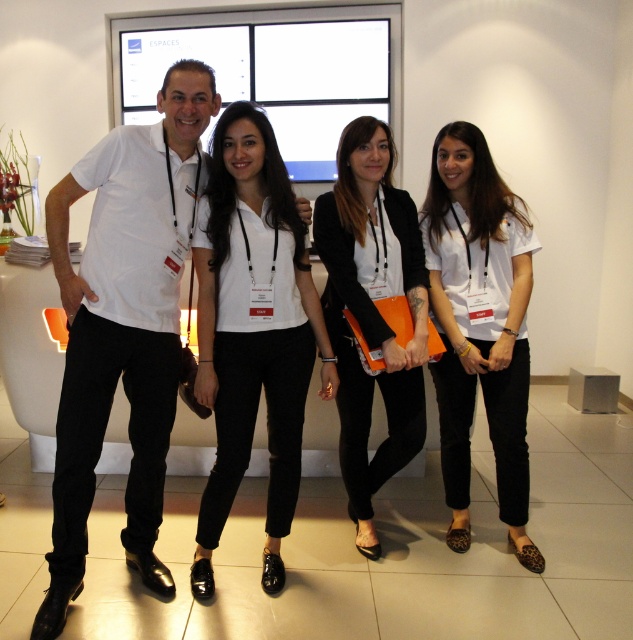
Question: Which object is closer to the camera taking this photo?

Choices:
 (A) black leather jacket at center
 (B) white matte shirt at center

Answer: (A)

Question: Can you confirm if white smooth shirt at left is positioned above black leather jacket at center?

Choices:
 (A) yes
 (B) no

Answer: (A)

Question: Considering the relative positions of white matte shirt at center and black leather jacket at center in the image provided, where is white matte shirt at center located with respect to black leather jacket at center?

Choices:
 (A) left
 (B) right

Answer: (B)

Question: Which of the following is the farthest from the observer?

Choices:
 (A) (206, 326)
 (B) (498, 458)
 (C) (380, 284)

Answer: (B)

Question: Which point appears farthest from the camera in this image?

Choices:
 (A) [120, 148]
 (B) [230, 257]
 (C) [448, 404]
 (D) [398, 392]

Answer: (C)

Question: Is white smooth shirt at left to the left of white matte shirt at center from the viewer's perspective?

Choices:
 (A) yes
 (B) no

Answer: (A)